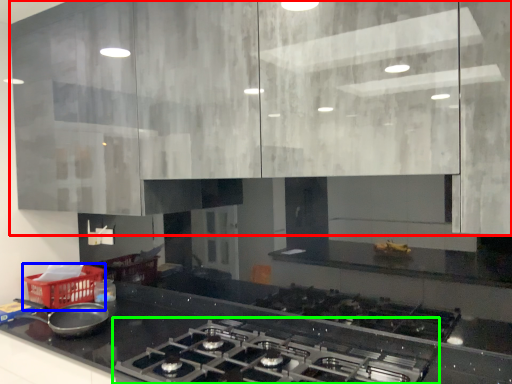
Question: Estimate the real-world distances between objects in this image. Which object is closer to cabinetry (highlighted by a red box), basket (highlighted by a blue box) or gas stove (highlighted by a green box)?

Choices:
 (A) basket
 (B) gas stove

Answer: (B)